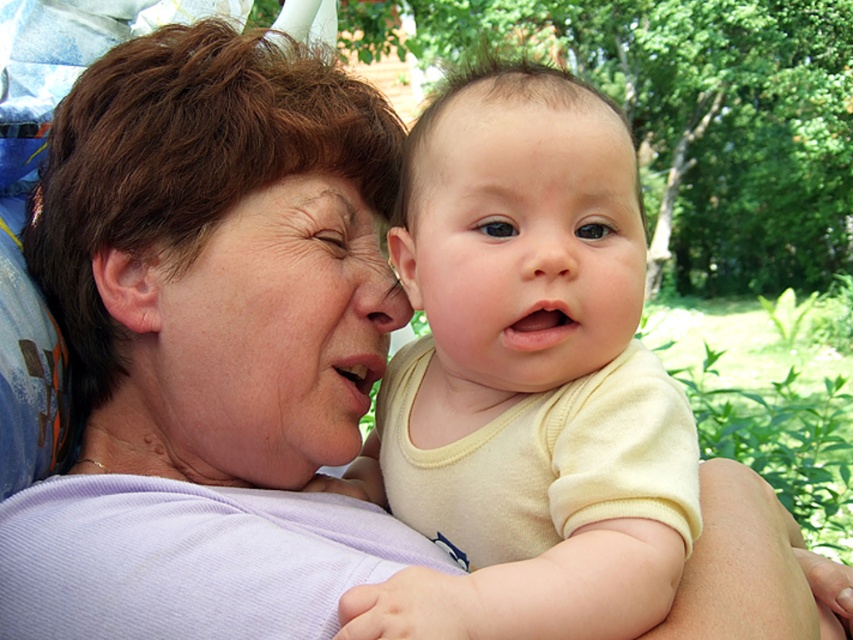
You are a photographer adjusting the camera focus. The subject is the smooth cream shirt at center and the smooth skin nose at center. Which object is positioned higher in the frame?

The smooth cream shirt at center is much taller than the smooth skin nose at center, so the smooth cream shirt at center is positioned higher in the frame.

You are a photographer adjusting your camera focus. You notice two areas of interest in the image at the center of the frame. One is the smooth cream shirt at center and the other is the smooth skin at center. Which one should you focus on to ensure the subject is sharp if you want the baby to be the main focus?

The smooth skin at center should be focused on because it is the baby and the smooth cream shirt at center is closer to the viewer but the skin is part of the baby which is the main subject.

Looking at the image, which object is taller between the smooth skin face at center and the smooth skin at center?

The smooth skin face at center is much taller as smooth skin at center.